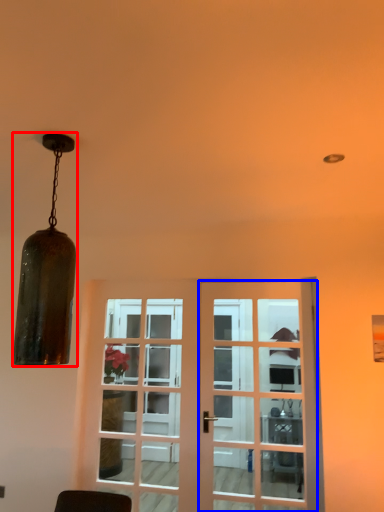
Question: Which object is further to the camera taking this photo, lamp (highlighted by a red box) or door (highlighted by a blue box)?

Choices:
 (A) lamp
 (B) door

Answer: (B)